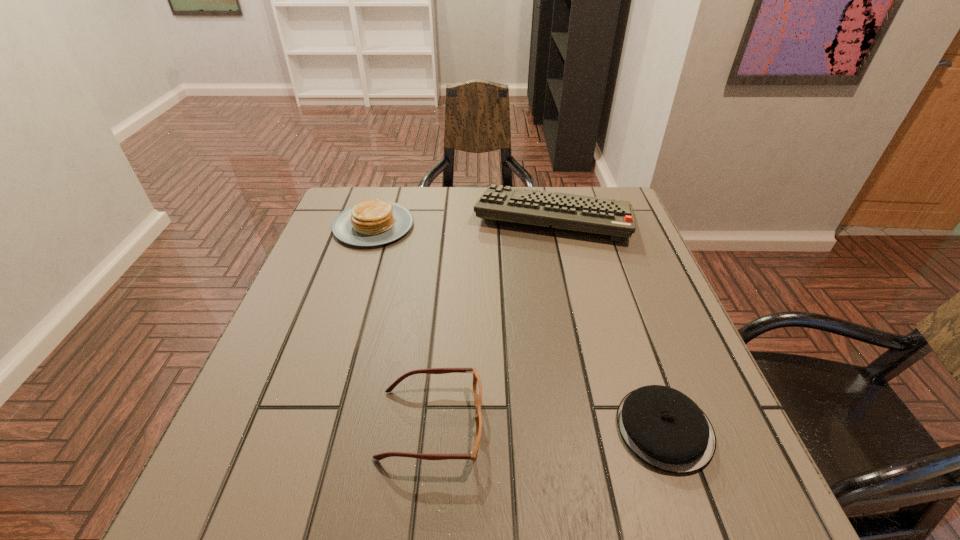
What are the coordinates of `computer keyboard positioned at the far edge` in the screenshot? It's located at (582, 213).

Locate an element on the screen. pancake that is at the far edge is located at coordinates [376, 222].

Identify the location of spectacles located at the near edge. This screenshot has height=540, width=960. (477, 386).

Image resolution: width=960 pixels, height=540 pixels. Identify the location of pancake present at the near edge. (663, 427).

The height and width of the screenshot is (540, 960). What are the coordinates of `object located in the left edge section of the desktop` in the screenshot? It's located at (376, 222).

The image size is (960, 540). Find the location of `computer keyboard positioned at the right edge`. computer keyboard positioned at the right edge is located at coordinates (582, 213).

Where is `pancake that is positioned at the right edge`? pancake that is positioned at the right edge is located at coordinates (663, 427).

Locate an element on the screen. This screenshot has height=540, width=960. object at the far left corner is located at coordinates (376, 222).

Find the location of a particular element. object located in the far right corner section of the desktop is located at coordinates (582, 213).

Locate an element on the screen. object that is positioned at the near right corner is located at coordinates (663, 427).